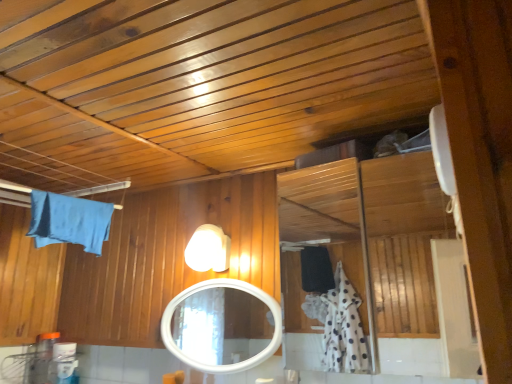
Question: Choose the correct answer: Is blue fabric bath towel at upper left inside white glossy exhaust hood at upper right or outside it?

Choices:
 (A) inside
 (B) outside

Answer: (B)

Question: Looking at their shapes, would you say blue fabric bath towel at upper left is wider or thinner than white glossy exhaust hood at upper right?

Choices:
 (A) wide
 (B) thin

Answer: (B)

Question: Which is farther from the blue fabric bath towel at upper left?

Choices:
 (A) white glossy mirror at center
 (B) white glossy light fixture at upper center
 (C) white glossy exhaust hood at upper right

Answer: (A)

Question: Considering the real-world distances, which object is closest to the white glossy light fixture at upper center?

Choices:
 (A) blue fabric bath towel at upper left
 (B) white glossy mirror at center
 (C) white glossy exhaust hood at upper right

Answer: (A)